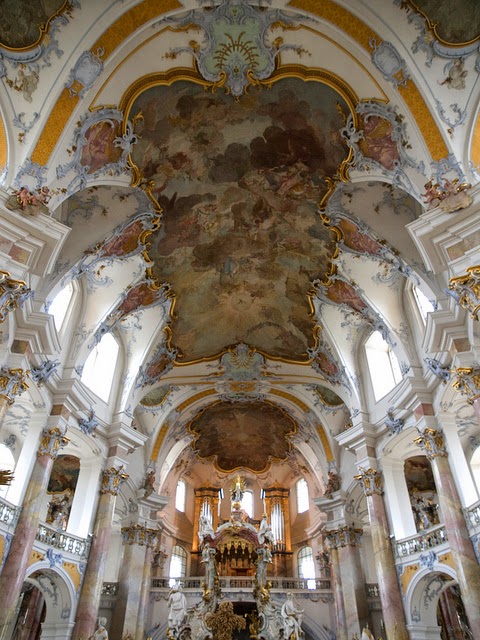
The width and height of the screenshot is (480, 640). Find the location of `white wall and ceiling with blue designs`. white wall and ceiling with blue designs is located at coordinates (86, 468), (397, 498), (349, 324), (105, 303).